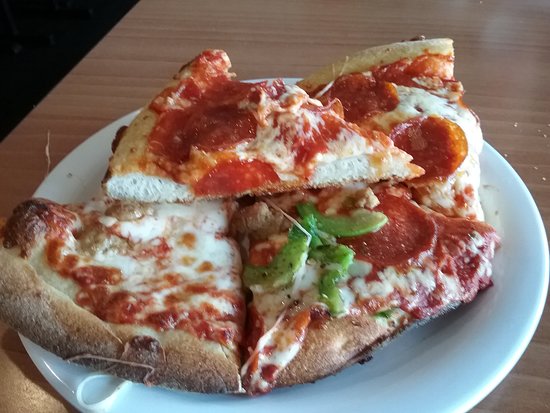
This screenshot has height=413, width=550. What are the coordinates of `empty space behind the table` in the screenshot? It's located at (53, 26).